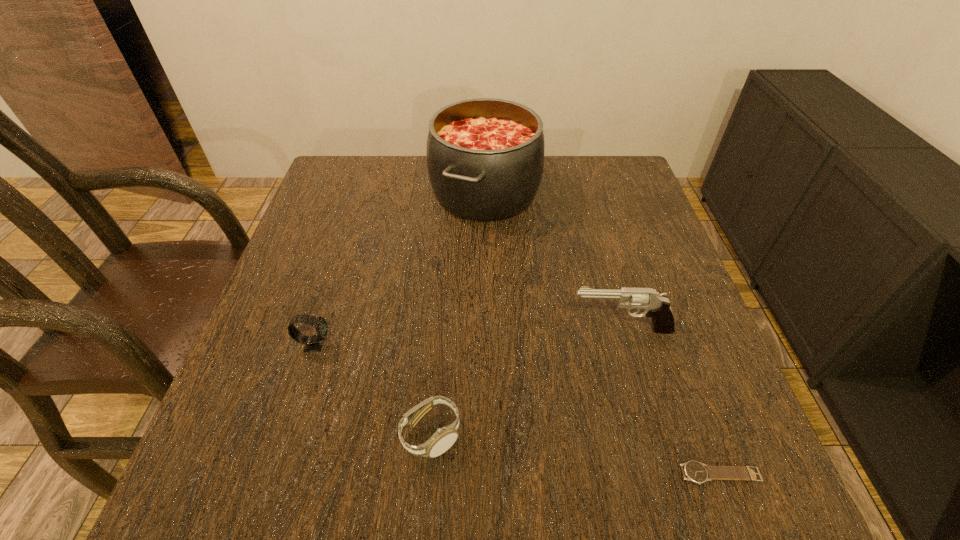
Find the location of a particular element. The width and height of the screenshot is (960, 540). watch that can be found as the second closest to the second tallest watch is located at coordinates (694, 471).

Identify the location of blank space that satisfies the following two spatial constraints: 1. on the face of the rightmost watch; 2. on the left side of the third tallest object. The height and width of the screenshot is (540, 960). (274, 474).

The image size is (960, 540). Find the location of `free space that satisfies the following two spatial constraints: 1. on the back side of the shortest watch; 2. on the face of the second watch from right to left`. free space that satisfies the following two spatial constraints: 1. on the back side of the shortest watch; 2. on the face of the second watch from right to left is located at coordinates (706, 435).

The height and width of the screenshot is (540, 960). I want to click on vacant position in the image that satisfies the following two spatial constraints: 1. on the face of the tallest watch; 2. on the right side of the shortest watch, so click(x=274, y=474).